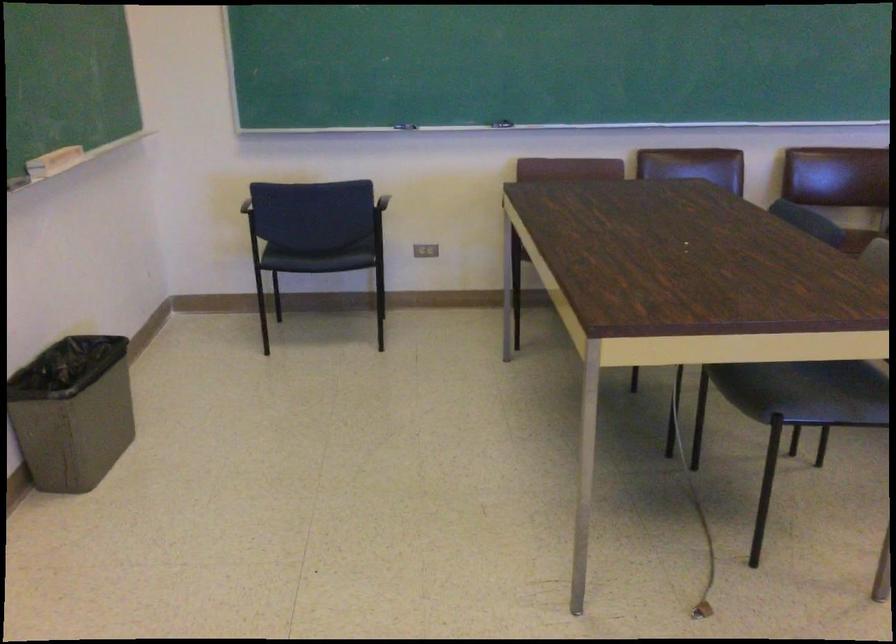
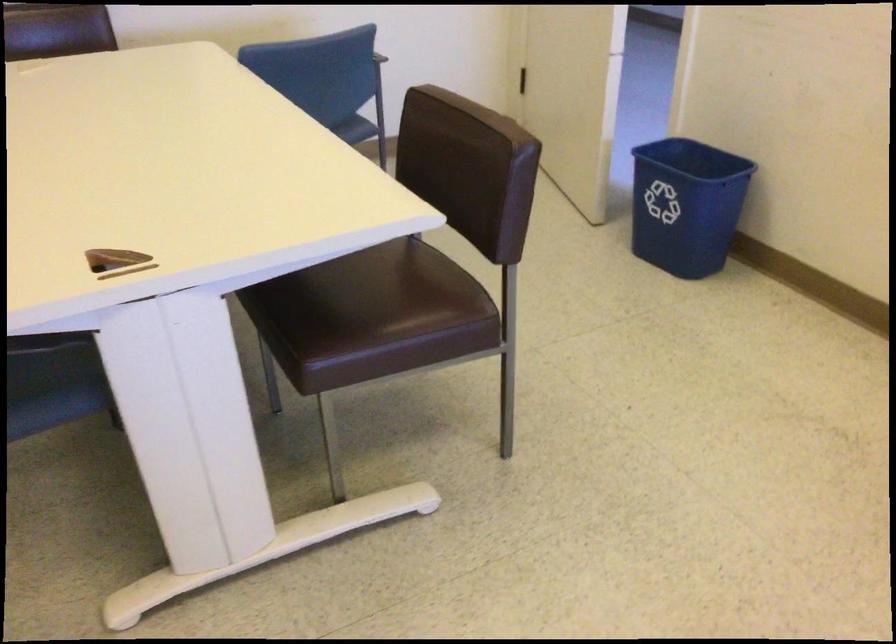
Question: In a continuous first-person perspective shot, in which direction is the camera moving?

Choices:
 (A) Left
 (B) Right
 (C) Forward
 (D) Backward

Answer: (B)